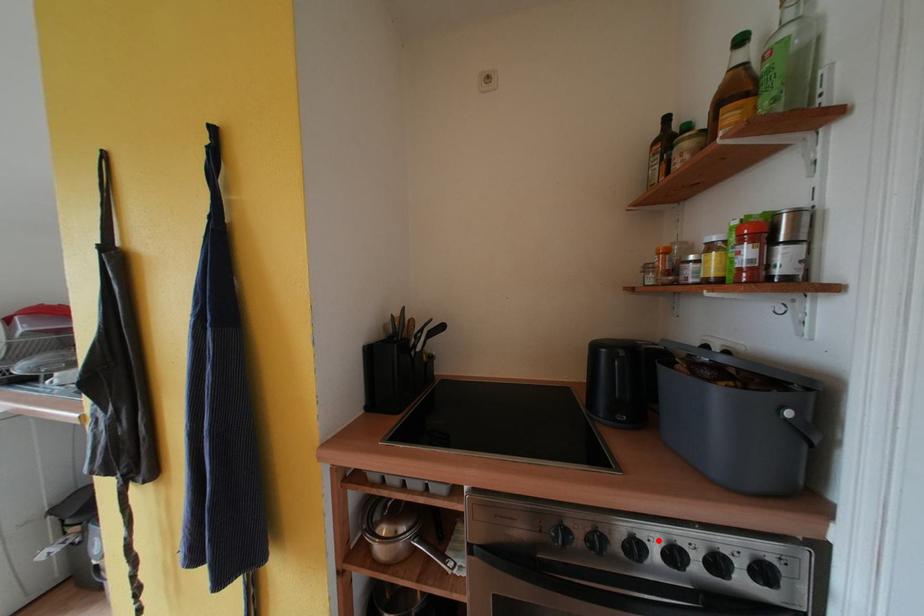
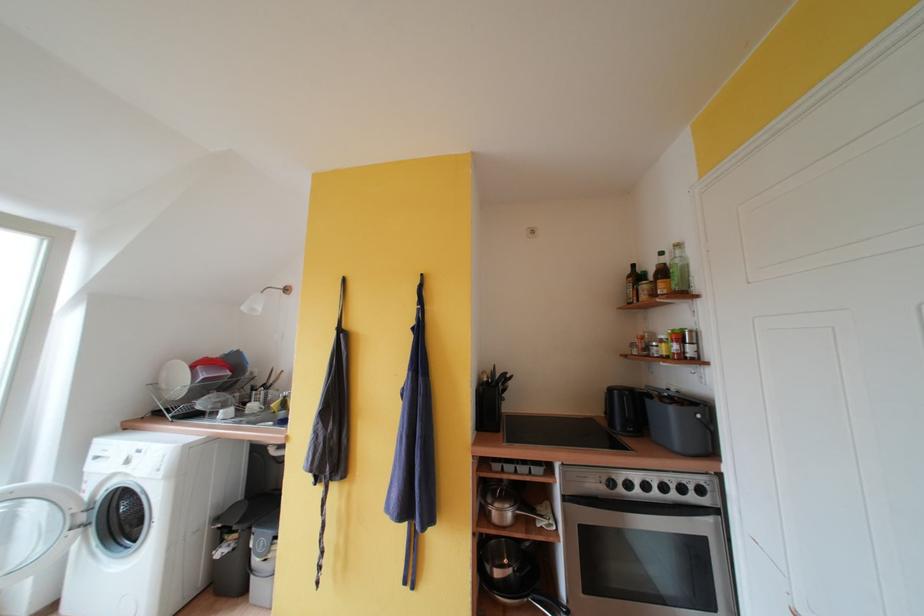
Question: I am providing you with two images of the same scene from different viewpoints. A red point is shown in image1. For the corresponding object point in image2, is it positioned nearer or farther from the camera?

Choices:
 (A) Nearer
 (B) Farther

Answer: (A)